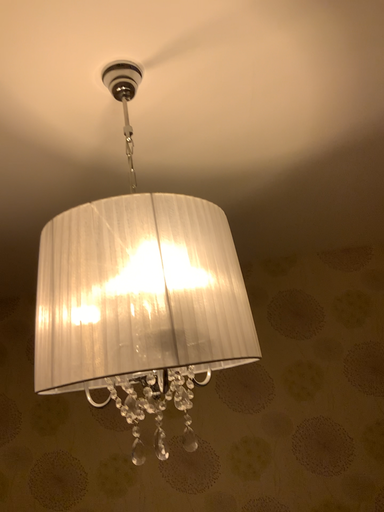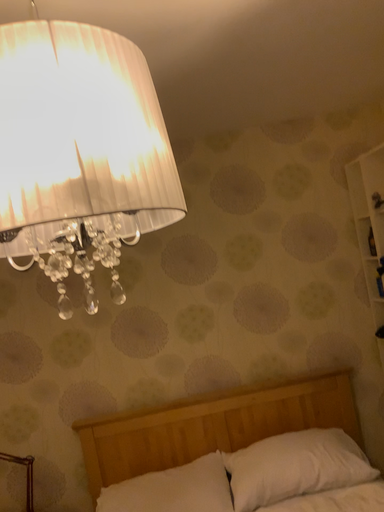
Question: How did the camera likely rotate when shooting the video?

Choices:
 (A) rotated downward
 (B) rotated upward

Answer: (A)